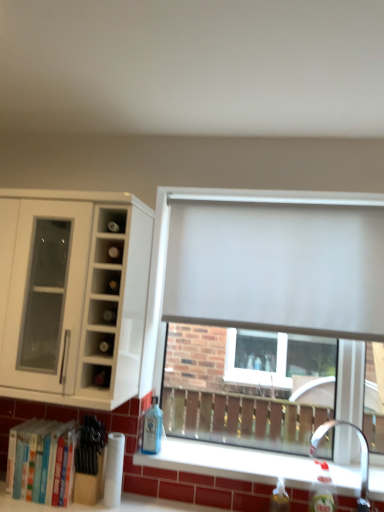
Find the location of a particular element. The image size is (384, 512). vacant point above white glossy window sill at lower center (from a real-world perspective) is located at coordinates (228, 459).